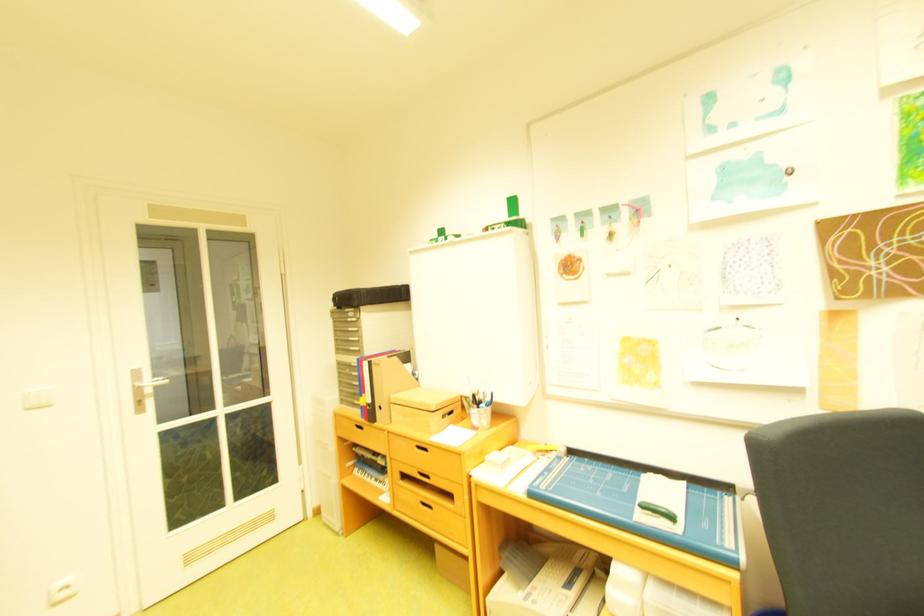
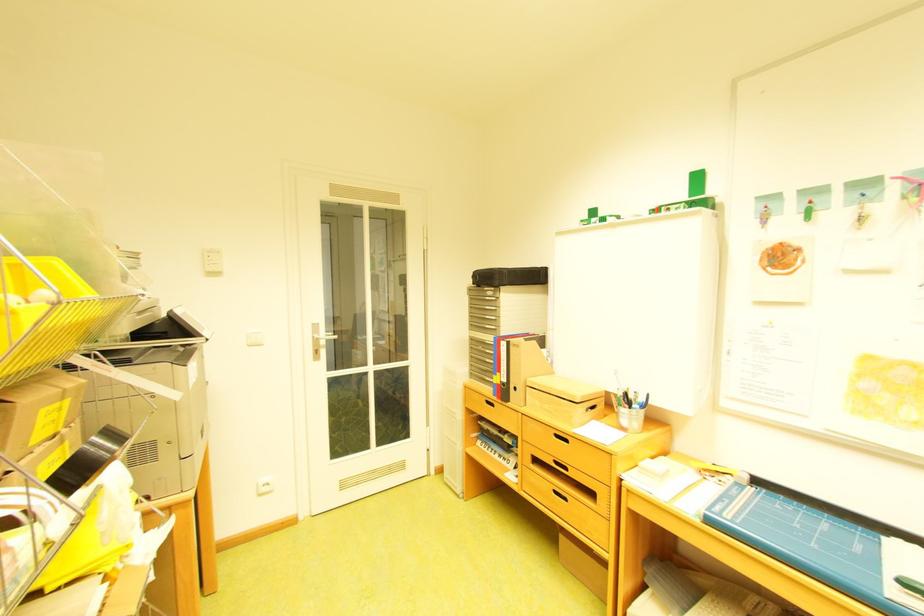
In the second image, find the point that corresponds to (x=561, y=487) in the first image.

(747, 517)